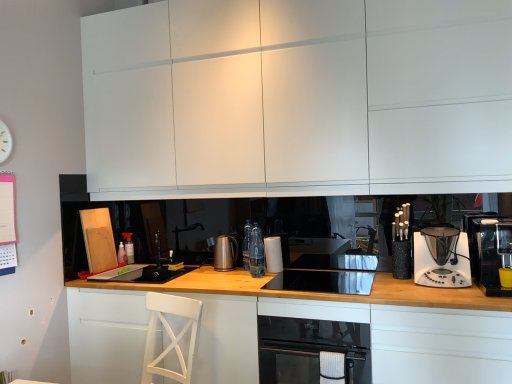
Image resolution: width=512 pixels, height=384 pixels. I want to click on free area in between black plastic coffee machine at right, which appears as the first kitchen appliance when viewed from the right, and white plastic blender at right, the 2th kitchen appliance in the back-to-front sequence, so click(x=454, y=286).